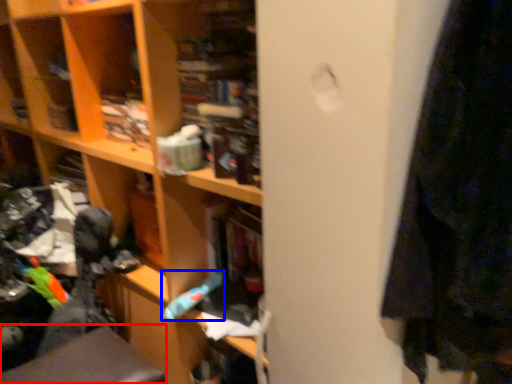
Question: Among these objects, which one is nearest to the camera, swivel chair (highlighted by a red box) or toy (highlighted by a blue box)?

Choices:
 (A) swivel chair
 (B) toy

Answer: (A)